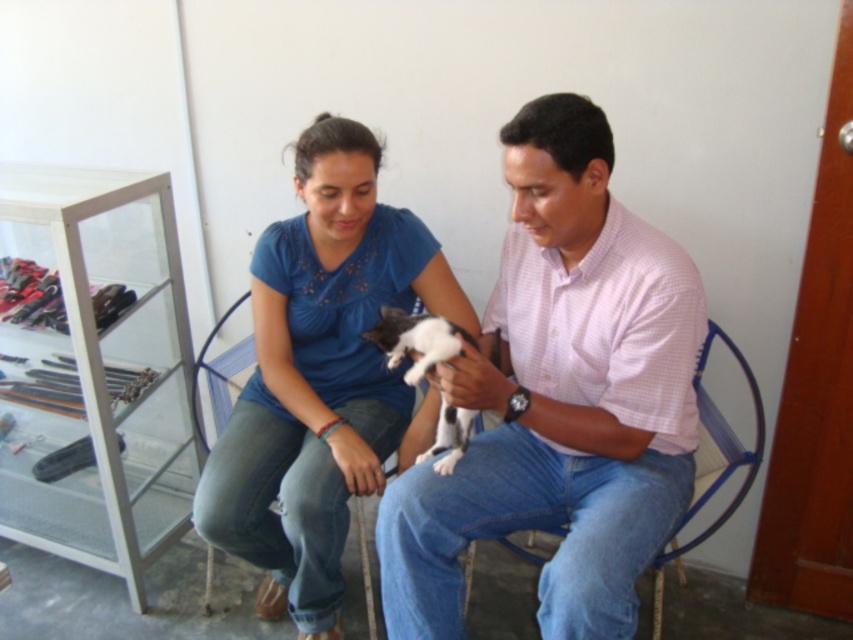
Question: In this image, where is black and white fur cat at center located relative to blue mesh chair at center?

Choices:
 (A) left
 (B) right

Answer: (B)

Question: Which object is farther from the camera taking this photo?

Choices:
 (A) blue cotton shirt at center
 (B) black and white fur cat at center

Answer: (A)

Question: Which point is closer to the camera taking this photo?

Choices:
 (A) (398, 348)
 (B) (273, 557)

Answer: (A)

Question: Where is pink checkered shirt at center located in relation to blue woven chair at center in the image?

Choices:
 (A) below
 (B) above

Answer: (B)

Question: Among these objects, which one is nearest to the camera?

Choices:
 (A) blue cotton shirt at center
 (B) pink checkered shirt at center

Answer: (B)

Question: Does black and white fur cat at center have a smaller size compared to blue mesh chair at center?

Choices:
 (A) yes
 (B) no

Answer: (B)